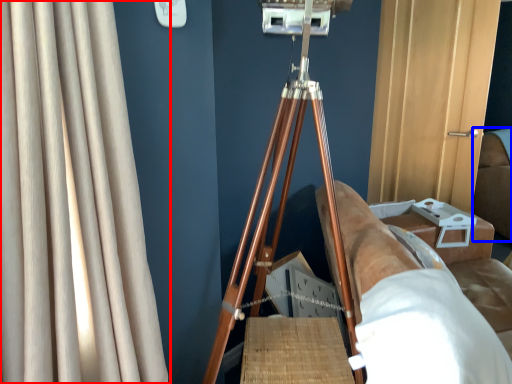
Question: Which point is closer to the camera, curtain (highlighted by a red box) or couch (highlighted by a blue box)?

Choices:
 (A) curtain
 (B) couch

Answer: (A)